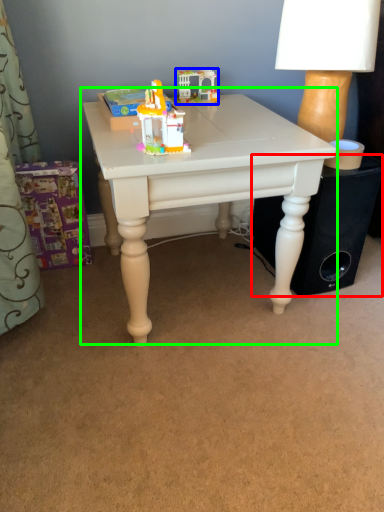
Question: Based on their relative distances, which object is nearer to speaker (highlighted by a red box)? Choose from toy (highlighted by a blue box) and table (highlighted by a green box).

Choices:
 (A) toy
 (B) table

Answer: (B)